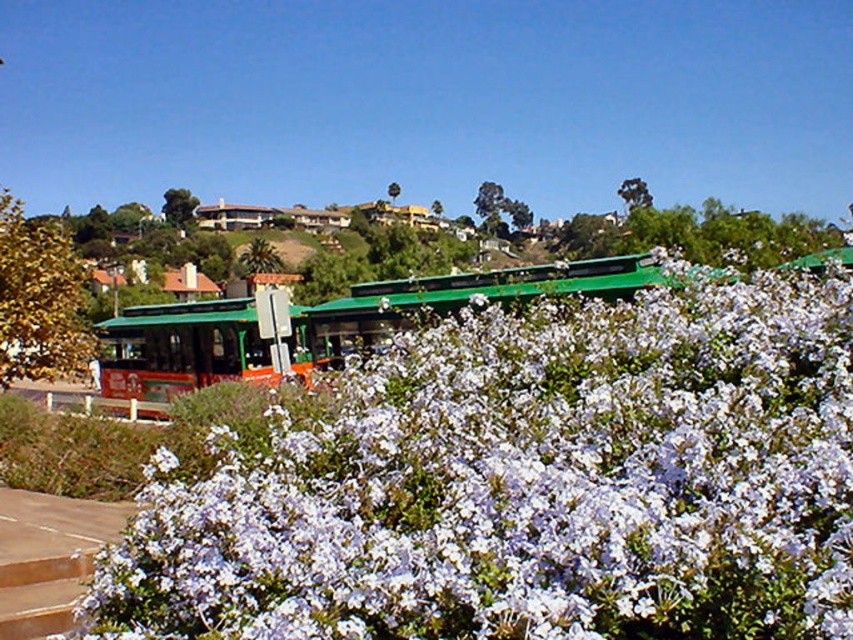
Looking at this image, is the position of green matte bus stop at center less distant than that of green leafy bush at lower left?

Yes, it is in front of green leafy bush at lower left.

Does point (434, 307) come behind point (102, 424)?

Yes.

The image size is (853, 640). I want to click on green matte bus stop at center, so click(450, 301).

Who is shorter, yellow-green leafy bush at upper left or green leafy bush at lower left?

With less height is green leafy bush at lower left.

Can you confirm if yellow-green leafy bush at upper left is positioned below green leafy bush at lower left?

No.

Who is more forward, (24, 243) or (163, 428)?

Point (163, 428)

At what (x,y) coordinates should I click in order to perform the action: click on yellow-green leafy bush at upper left. Please return your answer as a coordinate pair (x, y). This screenshot has width=853, height=640. Looking at the image, I should click on (38, 298).

Between green metallic bus stop at center and green leafy bush at lower left, which one is positioned lower?

green leafy bush at lower left is below.

Does green metallic bus stop at center have a lesser width compared to green leafy bush at lower left?

No.

Between point (223, 356) and point (19, 412), which one is positioned behind?

Positioned behind is point (223, 356).

At what (x,y) coordinates should I click in order to perform the action: click on green metallic bus stop at center. Please return your answer as a coordinate pair (x, y). The width and height of the screenshot is (853, 640). Looking at the image, I should click on (180, 348).